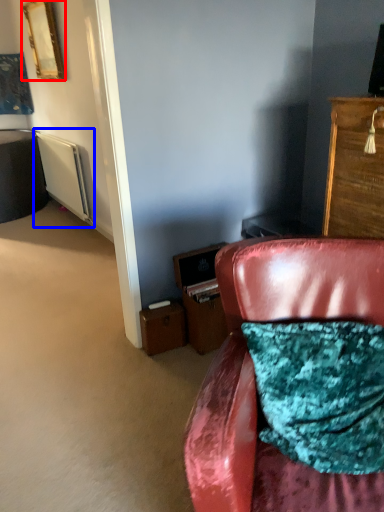
Question: Which object appears closest to the camera in this image, picture frame (highlighted by a red box) or radiator (highlighted by a blue box)?

Choices:
 (A) picture frame
 (B) radiator

Answer: (A)